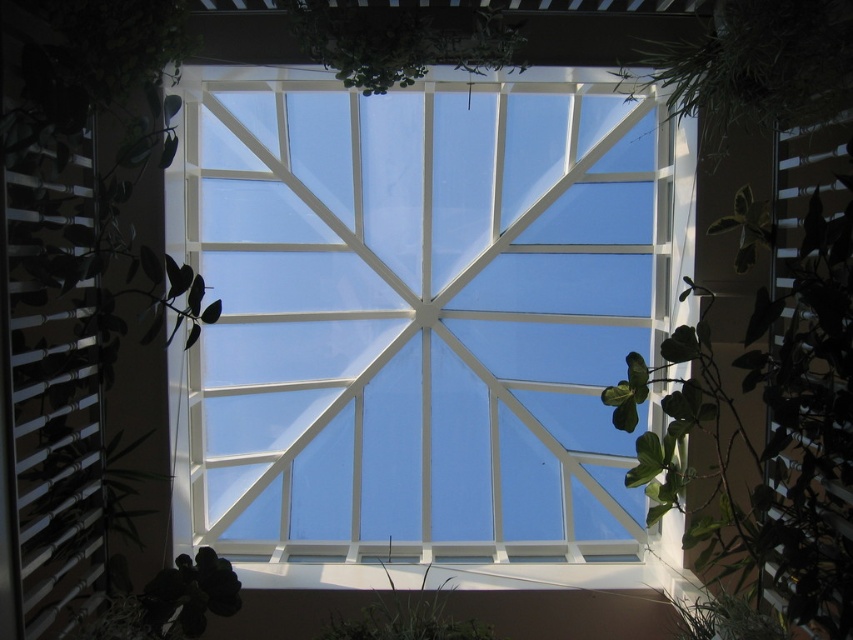
In the scene shown: Which is below, transparent glass window at center or green leafy plant at upper center?

transparent glass window at center

In the scene shown: Who is higher up, transparent glass window at center or green leafy plant at upper center?

green leafy plant at upper center is higher up.

Is point (222, 220) positioned behind point (426, 51)?

Yes, point (222, 220) is behind point (426, 51).

At what (x,y) coordinates should I click in order to perform the action: click on transparent glass window at center. Please return your answer as a coordinate pair (x, y). This screenshot has width=853, height=640. Looking at the image, I should click on (421, 314).

Is green leafy plant at upper right below green matte leaf at lower left?

Actually, green leafy plant at upper right is above green matte leaf at lower left.

Is point (779, 122) behind point (161, 588)?

No, it is not.

Where is `green leafy plant at upper right`? This screenshot has height=640, width=853. green leafy plant at upper right is located at coordinates (759, 67).

Does point (392, 54) come in front of point (398, 592)?

That is True.

Is point (437, 20) positioned in front of point (409, 636)?

No, it is not.

Where is `green leafy plant at upper center`? The image size is (853, 640). green leafy plant at upper center is located at coordinates (401, 40).